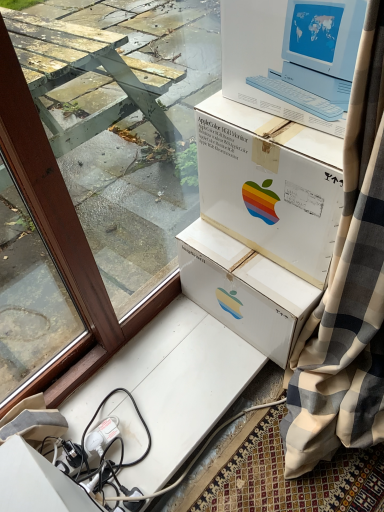
Question: Is white plastic apple monitor at upper center to the right of white cardboard box at upper center from the viewer's perspective?

Choices:
 (A) yes
 (B) no

Answer: (B)

Question: Is white plastic apple monitor at upper center not near white cardboard box at upper center?

Choices:
 (A) yes
 (B) no

Answer: (B)

Question: Can you confirm if white plastic apple monitor at upper center is bigger than white cardboard box at upper center?

Choices:
 (A) no
 (B) yes

Answer: (A)

Question: Considering the relative sizes of white plastic apple monitor at upper center and white cardboard box at upper center in the image provided, is white plastic apple monitor at upper center smaller than white cardboard box at upper center?

Choices:
 (A) yes
 (B) no

Answer: (A)

Question: Can you confirm if white plastic apple monitor at upper center is shorter than white cardboard box at upper center?

Choices:
 (A) yes
 (B) no

Answer: (A)

Question: From a real-world perspective, relative to white cardboard box at upper center, is brown wood window frame at upper left vertically above or below?

Choices:
 (A) below
 (B) above

Answer: (B)

Question: Considering the positions of point (11, 325) and point (327, 266), is point (11, 325) closer or farther from the camera than point (327, 266)?

Choices:
 (A) farther
 (B) closer

Answer: (A)

Question: From the image's perspective, is brown wood window frame at upper left positioned above or below white cardboard box at upper center?

Choices:
 (A) above
 (B) below

Answer: (B)

Question: Based on their sizes in the image, would you say brown wood window frame at upper left is bigger or smaller than white cardboard box at upper center?

Choices:
 (A) big
 (B) small

Answer: (A)

Question: Considering the positions of white cardboard box at upper center and white plastic apple monitor at upper center in the image, is white cardboard box at upper center wider or thinner than white plastic apple monitor at upper center?

Choices:
 (A) wide
 (B) thin

Answer: (A)

Question: Is white cardboard box at upper center spatially inside white plastic apple monitor at upper center, or outside of it?

Choices:
 (A) inside
 (B) outside

Answer: (B)

Question: From a real-world perspective, is white cardboard box at upper center above or below white plastic apple monitor at upper center?

Choices:
 (A) above
 (B) below

Answer: (B)

Question: Does point (274, 220) appear closer or farther from the camera than point (327, 82)?

Choices:
 (A) closer
 (B) farther

Answer: (B)

Question: From a real-world perspective, is white plastic apple monitor at upper center physically located above or below brown wood window frame at upper left?

Choices:
 (A) above
 (B) below

Answer: (A)

Question: Which is correct: white plastic apple monitor at upper center is inside brown wood window frame at upper left, or outside of it?

Choices:
 (A) inside
 (B) outside

Answer: (B)